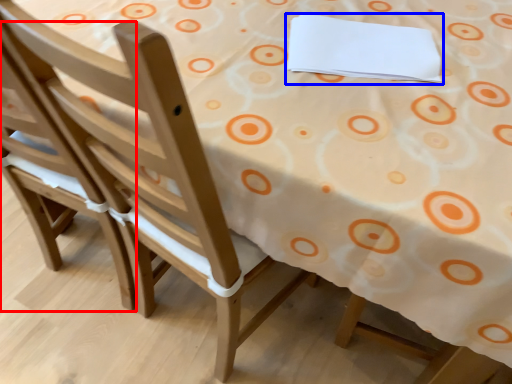
Question: Which object appears farthest to the camera in this image, chair (highlighted by a red box) or notepad (highlighted by a blue box)?

Choices:
 (A) chair
 (B) notepad

Answer: (B)